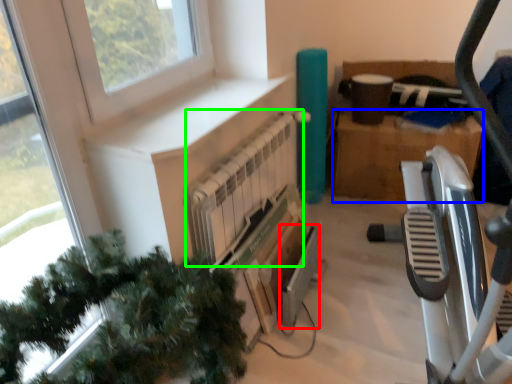
Question: Which object is positioned closest to appliance (highlighted by a red box)? Select from cardboard box (highlighted by a blue box) and radiator (highlighted by a green box).

Choices:
 (A) cardboard box
 (B) radiator

Answer: (B)